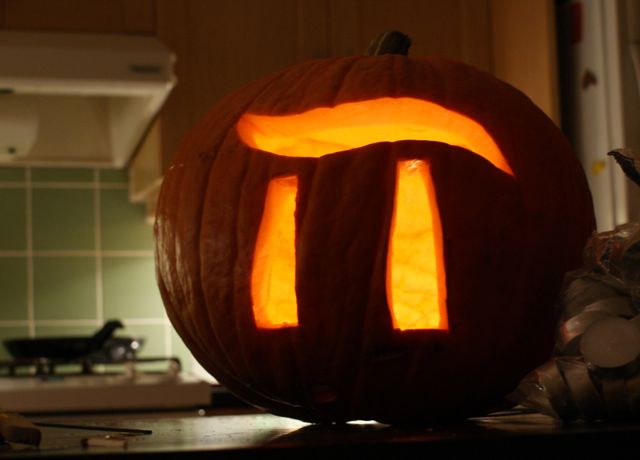
Identify the location of countertop. (207, 438).